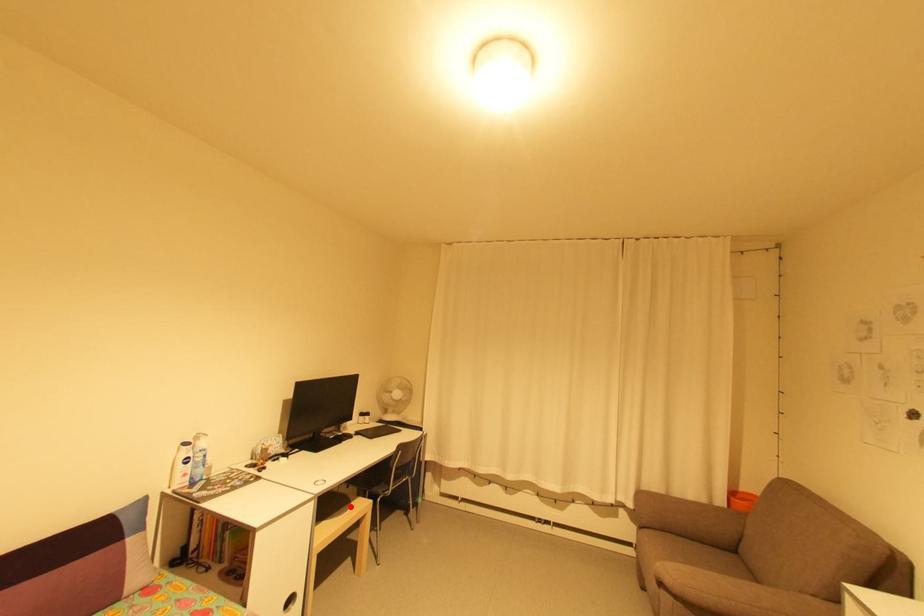
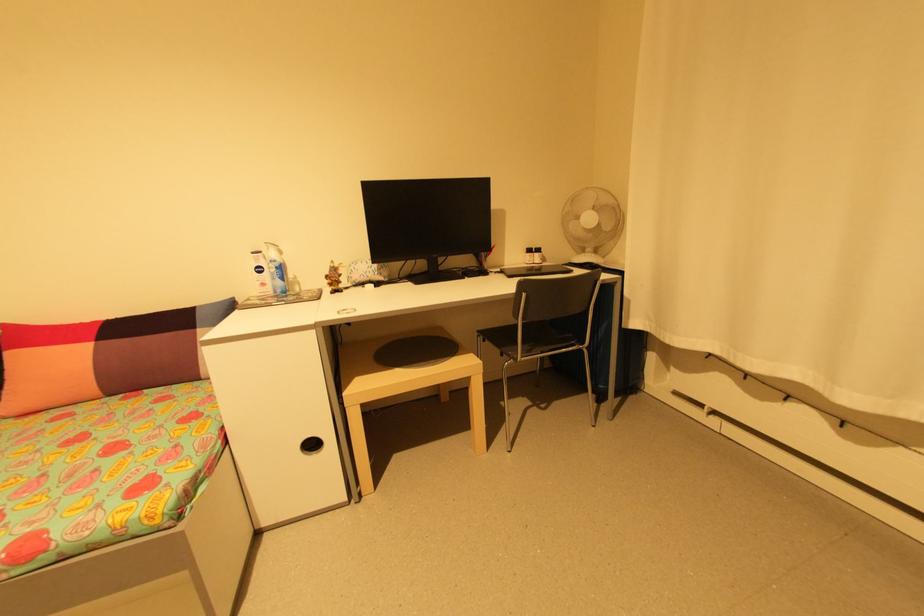
Where in the second image is the point corresponding to the highlighted location from the first image?

(445, 360)